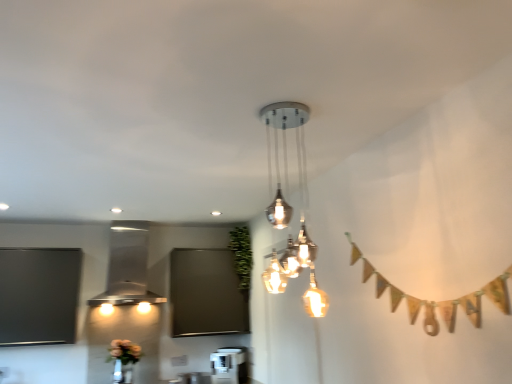
Question: Is satin silver pendant light at center, which appears as the 2th lamp when viewed from the left, behind stainless steel range hood at left, marked as the 2th lamp in a front-to-back arrangement?

Choices:
 (A) yes
 (B) no

Answer: (B)

Question: From the image's perspective, is satin silver pendant light at center, marked as the 1th lamp in a front-to-back arrangement, below stainless steel range hood at left, marked as the 2th lamp in a front-to-back arrangement?

Choices:
 (A) yes
 (B) no

Answer: (B)

Question: From a real-world perspective, is satin silver pendant light at center, the 1th lamp viewed from the right, beneath stainless steel range hood at left, marked as the 1th lamp in a left-to-right arrangement?

Choices:
 (A) yes
 (B) no

Answer: (A)

Question: Considering the relative positions of satin silver pendant light at center, marked as the 1th lamp in a front-to-back arrangement, and stainless steel range hood at left, which is counted as the second lamp, starting from the right, in the image provided, is satin silver pendant light at center, marked as the 1th lamp in a front-to-back arrangement, to the left of stainless steel range hood at left, which is counted as the second lamp, starting from the right, from the viewer's perspective?

Choices:
 (A) yes
 (B) no

Answer: (B)

Question: Is satin silver pendant light at center, marked as the 1th lamp in a front-to-back arrangement, positioned with its back to stainless steel range hood at left, the first lamp in the back-to-front sequence?

Choices:
 (A) no
 (B) yes

Answer: (A)

Question: From the image's perspective, relative to green leafy plant at center, is stainless steel range hood at left, marked as the 1th lamp in a left-to-right arrangement, above or below?

Choices:
 (A) below
 (B) above

Answer: (A)

Question: From a real-world perspective, is stainless steel range hood at left, marked as the 1th lamp in a left-to-right arrangement, above or below green leafy plant at center?

Choices:
 (A) below
 (B) above

Answer: (A)

Question: Considering the positions of point (111, 274) and point (242, 274), is point (111, 274) closer or farther from the camera than point (242, 274)?

Choices:
 (A) farther
 (B) closer

Answer: (B)

Question: Relative to green leafy plant at center, is stainless steel range hood at left, which is counted as the second lamp, starting from the right, in front or behind?

Choices:
 (A) front
 (B) behind

Answer: (A)

Question: Do you think green leafy plant at center is within stainless steel range hood at left, marked as the 2th lamp in a front-to-back arrangement, or outside of it?

Choices:
 (A) inside
 (B) outside

Answer: (B)

Question: Considering the positions of green leafy plant at center and stainless steel range hood at left, marked as the 2th lamp in a front-to-back arrangement, in the image, is green leafy plant at center wider or thinner than stainless steel range hood at left, marked as the 2th lamp in a front-to-back arrangement,?

Choices:
 (A) wide
 (B) thin

Answer: (B)

Question: Considering the positions of green leafy plant at center and stainless steel range hood at left, which is counted as the second lamp, starting from the right, in the image, is green leafy plant at center bigger or smaller than stainless steel range hood at left, which is counted as the second lamp, starting from the right,?

Choices:
 (A) small
 (B) big

Answer: (A)

Question: From a real-world perspective, relative to stainless steel range hood at left, which is counted as the second lamp, starting from the right, is green leafy plant at center vertically above or below?

Choices:
 (A) below
 (B) above

Answer: (B)

Question: From their relative heights in the image, would you say satin silver pendant light at center, which is the second lamp in back-to-front order, is taller or shorter than stainless steel range hood at left, the first lamp in the back-to-front sequence?

Choices:
 (A) tall
 (B) short

Answer: (A)

Question: From a real-world perspective, is satin silver pendant light at center, marked as the 1th lamp in a front-to-back arrangement, physically located above or below stainless steel range hood at left, the first lamp in the back-to-front sequence?

Choices:
 (A) below
 (B) above

Answer: (A)